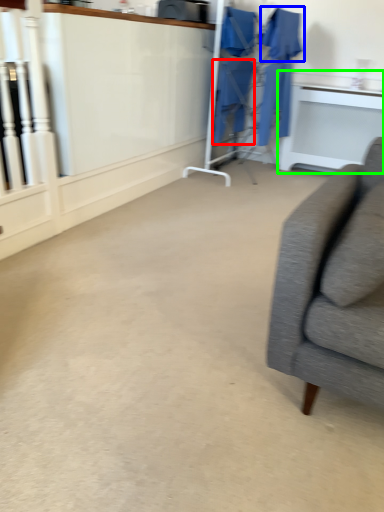
Question: Which object is positioned closest to robe (highlighted by a red box)? Select from robe (highlighted by a blue box) and table (highlighted by a green box).

Choices:
 (A) robe
 (B) table

Answer: (A)